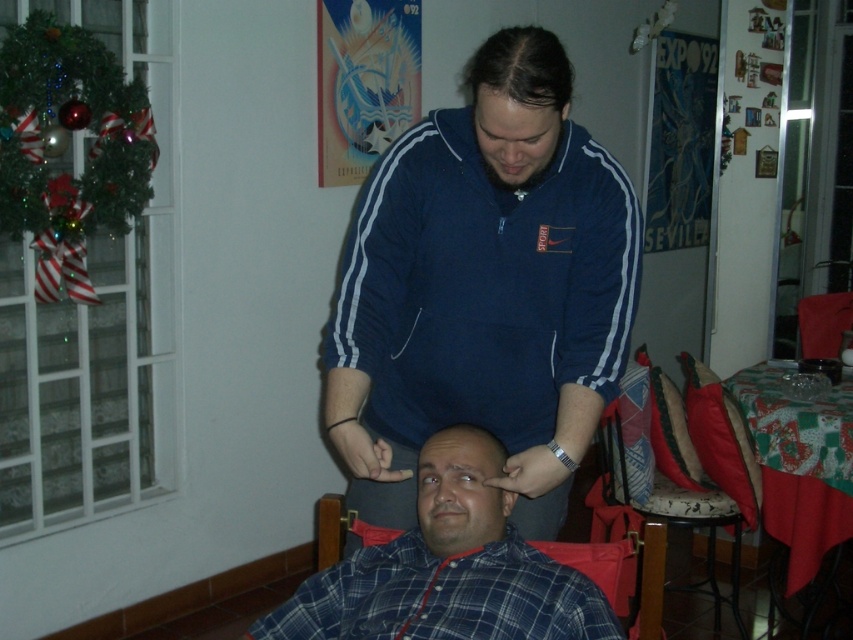
Question: Which point is farther to the camera?

Choices:
 (A) blue fleece jacket at upper center
 (B) dark brown hair at center

Answer: (B)

Question: Is blue plaid shirt at center below velvet cushioned chair at right?

Choices:
 (A) no
 (B) yes

Answer: (A)

Question: Which point is closer to the camera taking this photo?

Choices:
 (A) (511, 54)
 (B) (433, 417)

Answer: (A)

Question: Which point appears farthest from the camera in this image?

Choices:
 (A) (320, 634)
 (B) (701, 580)
 (C) (483, 218)

Answer: (B)

Question: Considering the relative positions of blue plaid shirt at center and velvet cushioned chair at right in the image provided, where is blue plaid shirt at center located with respect to velvet cushioned chair at right?

Choices:
 (A) right
 (B) left

Answer: (B)

Question: Is blue plaid shirt at center smaller than dark brown hair at center?

Choices:
 (A) no
 (B) yes

Answer: (A)